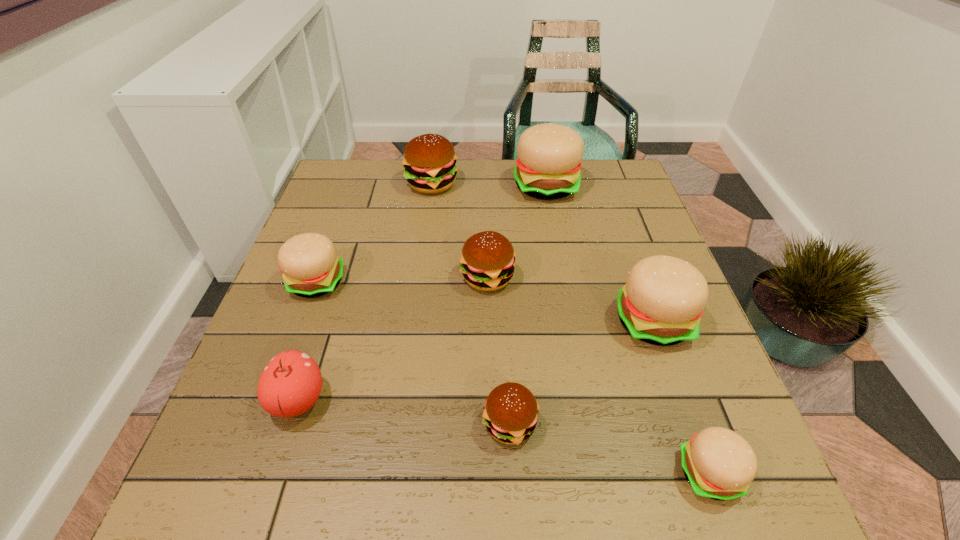
Identify the location of apple situated at the left edge. The width and height of the screenshot is (960, 540). (290, 384).

You are a GUI agent. You are given a task and a screenshot of the screen. Output one action in this format:
    pyautogui.click(x=<x>, y=<y>)
    Task: Click on the object that is at the near right corner
    This screenshot has height=540, width=960.
    Given the screenshot: What is the action you would take?
    click(x=720, y=464)

Where is `free location at the far edge of the desktop`? This screenshot has width=960, height=540. free location at the far edge of the desktop is located at coordinates (478, 194).

Where is `vacant area at the left edge of the desktop`? This screenshot has height=540, width=960. vacant area at the left edge of the desktop is located at coordinates (328, 231).

At what (x,y) coordinates should I click in order to perform the action: click on free spot at the right edge of the desktop. Please return your answer as a coordinate pair (x, y). The image size is (960, 540). Looking at the image, I should click on (625, 330).

In the image, there is a desktop. Where is `free space at the far left corner`? The height and width of the screenshot is (540, 960). free space at the far left corner is located at coordinates (348, 165).

Identify the location of free space at the near left corner. This screenshot has width=960, height=540. point(239,470).

The width and height of the screenshot is (960, 540). What are the coordinates of `free area in between the nearest beige hamburger and the second hamburger from left to right` in the screenshot? It's located at (570, 328).

At what (x,y) coordinates should I click in order to perform the action: click on vacant area that lies between the red apple and the third smallest beige hamburger. Please return your answer as a coordinate pair (x, y). The width and height of the screenshot is (960, 540). Looking at the image, I should click on point(475,360).

The height and width of the screenshot is (540, 960). In order to click on free space that is in between the second smallest brown hamburger and the nearest beige hamburger in this screenshot , I will do `click(599, 375)`.